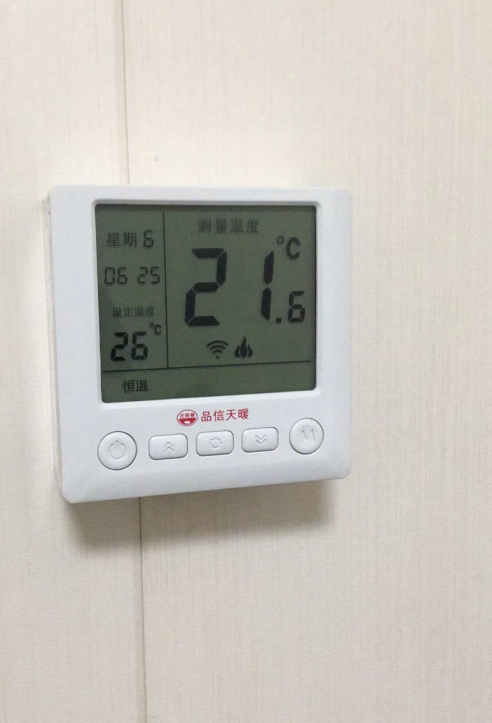
Locate an element on the screen. The height and width of the screenshot is (723, 492). digital display screen is located at coordinates coord(181,278).